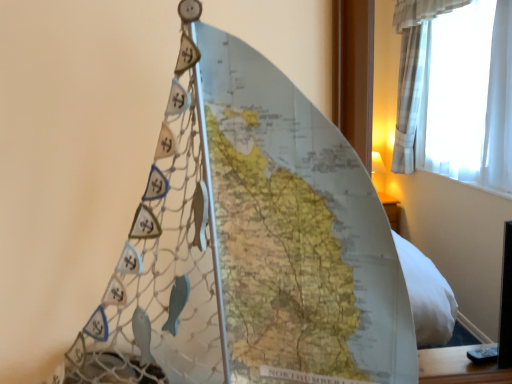
The width and height of the screenshot is (512, 384). Describe the element at coordinates (250, 243) in the screenshot. I see `map paper boat at center` at that location.

Identify the location of map paper boat at center. (250, 243).

Locate an element on the screen. The width and height of the screenshot is (512, 384). map paper boat at center is located at coordinates (250, 243).